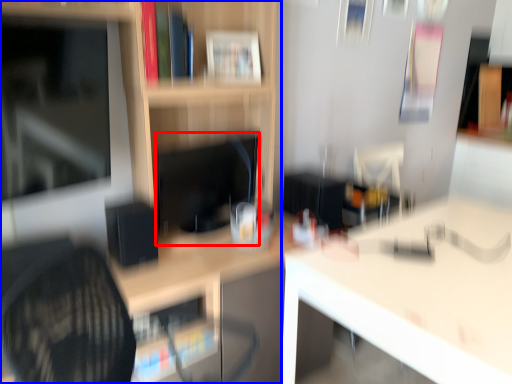
Question: Among these objects, which one is farthest to the camera, computer monitor (highlighted by a red box) or shelf (highlighted by a blue box)?

Choices:
 (A) computer monitor
 (B) shelf

Answer: (A)